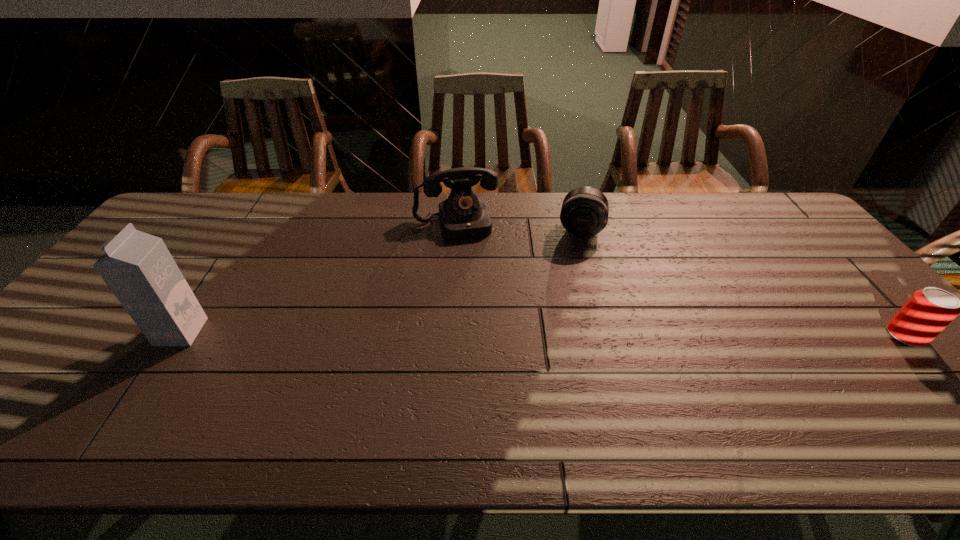
Find the location of a particular element. free point at the left edge is located at coordinates (119, 328).

In the image, there is a desktop. Identify the location of vacant space at the right edge. The image size is (960, 540). (816, 263).

This screenshot has height=540, width=960. In the image, there is a desktop. What are the coordinates of `vacant space at the far left corner` in the screenshot? It's located at (191, 199).

The height and width of the screenshot is (540, 960). In order to click on vacant area that lies between the tallest object and the beer can in this screenshot , I will do `click(543, 334)`.

Identify the location of free area in between the leftmost object and the beer can. (543, 334).

Find the location of `free space between the telephoto lens and the third object from right to left`. free space between the telephoto lens and the third object from right to left is located at coordinates (518, 226).

Image resolution: width=960 pixels, height=540 pixels. In order to click on vacant area that lies between the second object from right to left and the leftmost object in this screenshot , I will do `click(381, 280)`.

At what (x,y) coordinates should I click in order to perform the action: click on unoccupied area between the beer can and the carton. Please return your answer as a coordinate pair (x, y). Image resolution: width=960 pixels, height=540 pixels. Looking at the image, I should click on (543, 334).

At what (x,y) coordinates should I click in order to perform the action: click on vacant area that lies between the rightmost object and the third object from right to left. Please return your answer as a coordinate pair (x, y). This screenshot has width=960, height=540. Looking at the image, I should click on (681, 279).

Where is `vacant space that is in between the telephoto lens and the telephone`? The image size is (960, 540). vacant space that is in between the telephoto lens and the telephone is located at coordinates (518, 226).